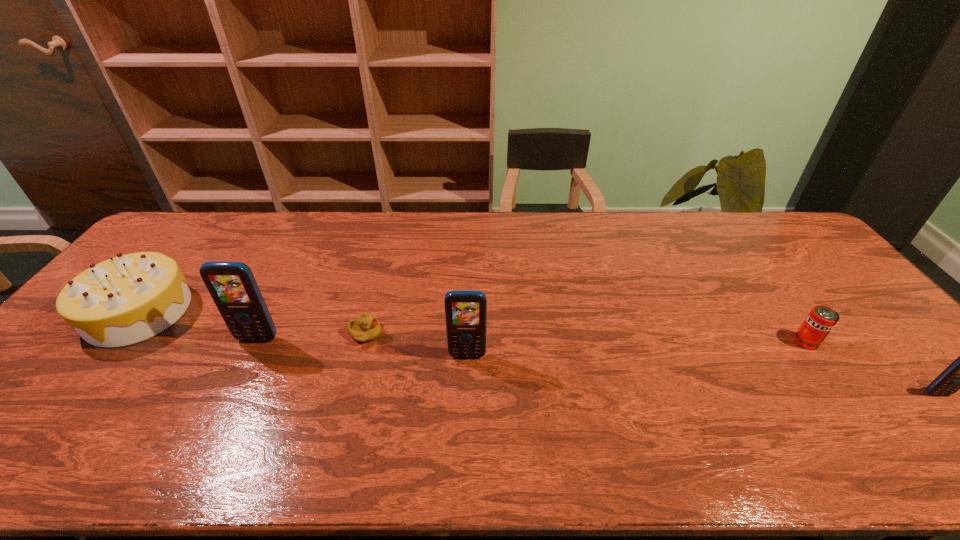
This screenshot has width=960, height=540. In order to click on the leftmost object in this screenshot , I will do `click(124, 300)`.

The image size is (960, 540). I want to click on vacant region located on the screen of the second object from left to right, so click(x=229, y=397).

Where is `free spot located 0.120m on the screen of the fifth shortest object`? free spot located 0.120m on the screen of the fifth shortest object is located at coordinates (466, 402).

Identify the location of vacant space located 0.240m on the left of the can. This screenshot has width=960, height=540. (704, 342).

You are a GUI agent. You are given a task and a screenshot of the screen. Output one action in this format:
    pyautogui.click(x=<x>, y=<y>)
    Task: Click on the vacant space located 0.100m on the front-facing side of the third object from left to right
    The width and height of the screenshot is (960, 540).
    Given the screenshot: What is the action you would take?
    pyautogui.click(x=420, y=334)

Locate an element on the screen. The height and width of the screenshot is (540, 960). vacant space located on the back of the leftmost object is located at coordinates (186, 253).

I want to click on object that is at the near edge, so click(959, 375).

This screenshot has width=960, height=540. I want to click on object at the left edge, so click(x=124, y=300).

Where is `object that is at the right edge`? The image size is (960, 540). object that is at the right edge is located at coordinates (959, 375).

Where is `object at the near right corner`? This screenshot has width=960, height=540. object at the near right corner is located at coordinates (959, 375).